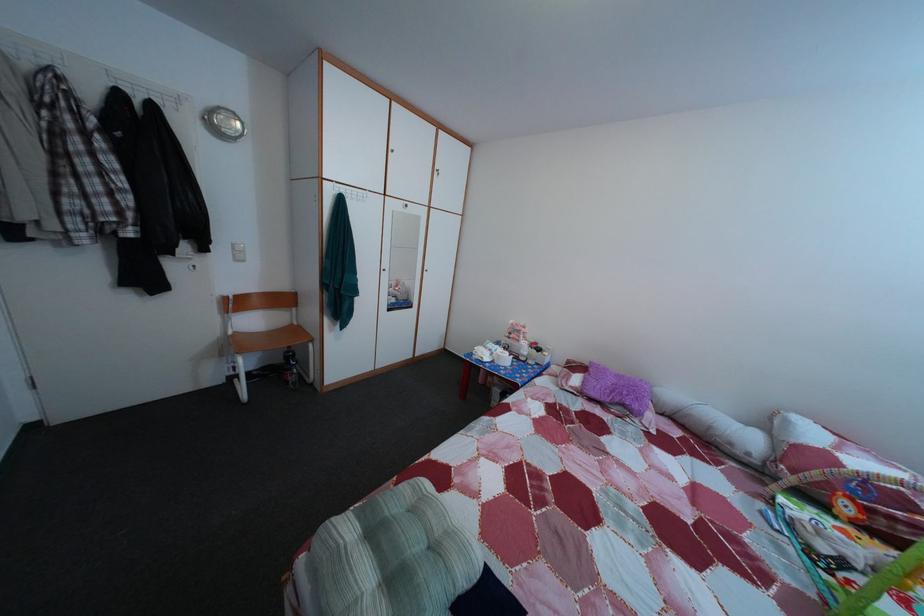
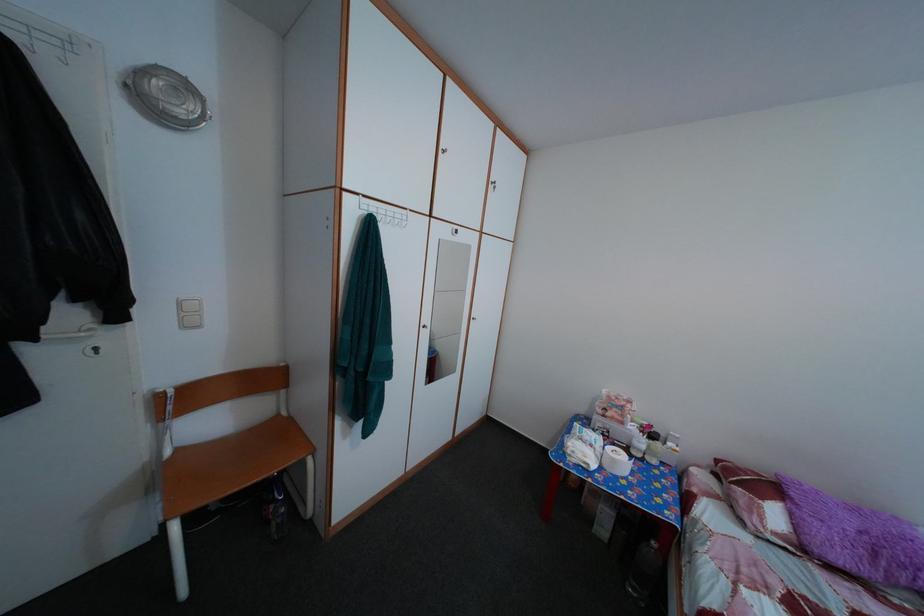
Question: The images are taken continuously from a first-person perspective. In which direction is your viewpoint rotating?

Choices:
 (A) Left
 (B) Right
 (C) Up
 (D) Down

Answer: (C)